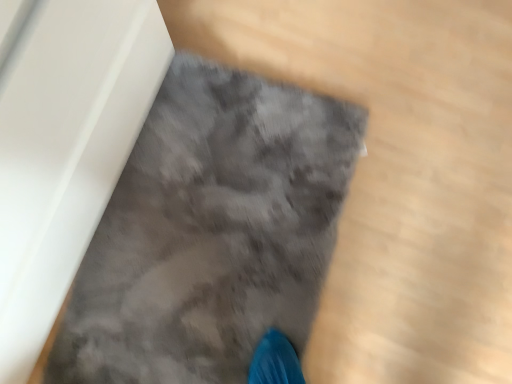
You are a GUI agent. You are given a task and a screenshot of the screen. Output one action in this format:
    pyautogui.click(x=<x>, y=<y>)
    Task: Click on the gray fluffy rug at lower left
    This screenshot has height=384, width=512.
    Given the screenshot: What is the action you would take?
    pyautogui.click(x=210, y=232)

Measure the distance between gray fluffy rug at lower left and camera.

gray fluffy rug at lower left and camera are 87.46 centimeters apart.

Image resolution: width=512 pixels, height=384 pixels. Describe the element at coordinates (210, 232) in the screenshot. I see `gray fluffy rug at lower left` at that location.

I want to click on gray fluffy rug at lower left, so click(210, 232).